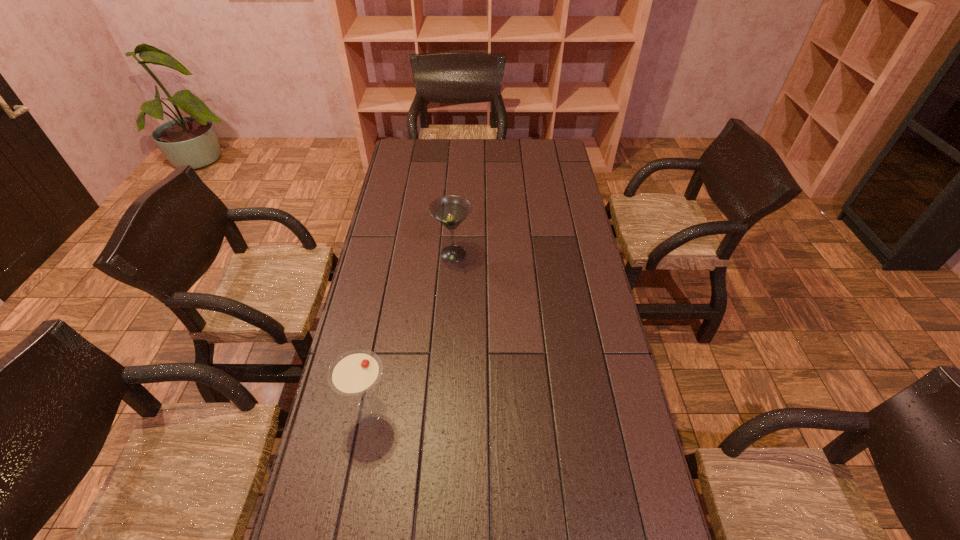
You are a GUI agent. You are given a task and a screenshot of the screen. Output one action in this format:
    pyautogui.click(x=<x>, y=<y>)
    Task: Click on the farther object
    Image resolution: width=960 pixels, height=540 pixels.
    Given the screenshot: What is the action you would take?
    pyautogui.click(x=451, y=210)

Find the location of a particular element. The width and height of the screenshot is (960, 540). the farther martini is located at coordinates (451, 210).

At what (x,y) coordinates should I click in order to perform the action: click on the nearer martini. Please return your answer as a coordinate pair (x, y). The height and width of the screenshot is (540, 960). Looking at the image, I should click on (354, 372).

Where is `the left object`? The image size is (960, 540). the left object is located at coordinates (354, 372).

Locate an element on the screen. The width and height of the screenshot is (960, 540). free point located on the left of the right object is located at coordinates (409, 254).

You are a GUI agent. You are given a task and a screenshot of the screen. Output one action in this format:
    pyautogui.click(x=<x>, y=<y>)
    Task: Click on the blank space located on the front of the left object
    
    Given the screenshot: What is the action you would take?
    pyautogui.click(x=359, y=467)

You are a GUI agent. You are given a task and a screenshot of the screen. Output one action in this format:
    pyautogui.click(x=<x>, y=<y>)
    Task: Click on the object that is at the left edge
    This screenshot has width=960, height=540.
    Given the screenshot: What is the action you would take?
    pyautogui.click(x=354, y=372)

Find the location of `free space at the far edge of the desktop`. free space at the far edge of the desktop is located at coordinates (524, 147).

Locate an element on the screen. This screenshot has width=960, height=540. vacant area at the left edge is located at coordinates (403, 214).

Identify the location of free space at the right edge of the desktop. (577, 361).